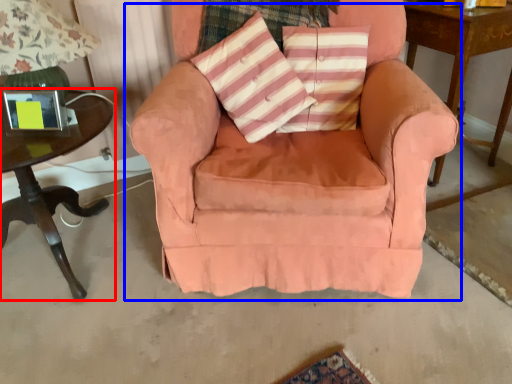
Question: Which object is closer to the camera taking this photo, table (highlighted by a red box) or chair (highlighted by a blue box)?

Choices:
 (A) table
 (B) chair

Answer: (B)